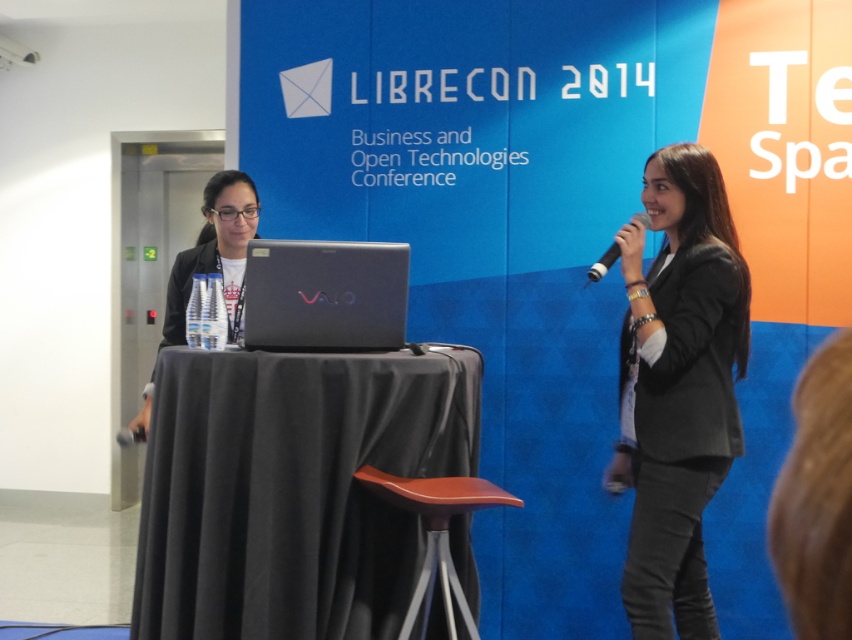
Between dark gray textured blazer at center and black matte microphone at upper right, which one appears on the right side from the viewer's perspective?

From the viewer's perspective, dark gray textured blazer at center appears more on the right side.

Who is positioned more to the left, dark gray textured blazer at center or black matte microphone at upper right?

From the viewer's perspective, black matte microphone at upper right appears more on the left side.

The image size is (852, 640). Find the location of `dark gray textured blazer at center`. dark gray textured blazer at center is located at coordinates (677, 388).

Does brown leather stool at center have a lesser height compared to black matte microphone at upper right?

No, brown leather stool at center is not shorter than black matte microphone at upper right.

Does brown leather stool at center appear over black matte microphone at upper right?

Actually, brown leather stool at center is below black matte microphone at upper right.

Which is behind, point (396, 484) or point (643, 220)?

Positioned behind is point (643, 220).

Identify the location of brown leather stool at center. The width and height of the screenshot is (852, 640). (436, 534).

Can you confirm if black fabric table at center is positioned to the right of matte black laptop at center?

Indeed, black fabric table at center is positioned on the right side of matte black laptop at center.

Which is above, black fabric table at center or matte black laptop at center?

matte black laptop at center

Does point (291, 376) lie behind point (226, 256)?

That is False.

Where is `black fabric table at center`? black fabric table at center is located at coordinates (292, 488).